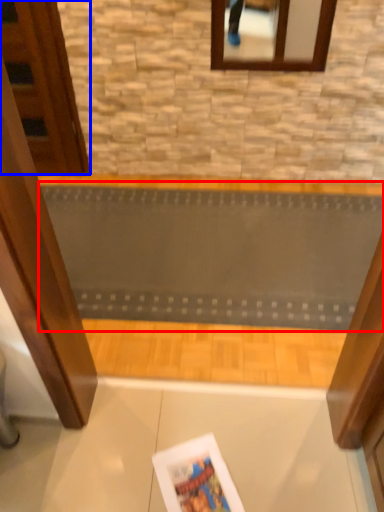
Question: Which object appears closest to the camera in this image, ramp (highlighted by a red box) or door (highlighted by a blue box)?

Choices:
 (A) ramp
 (B) door

Answer: (A)